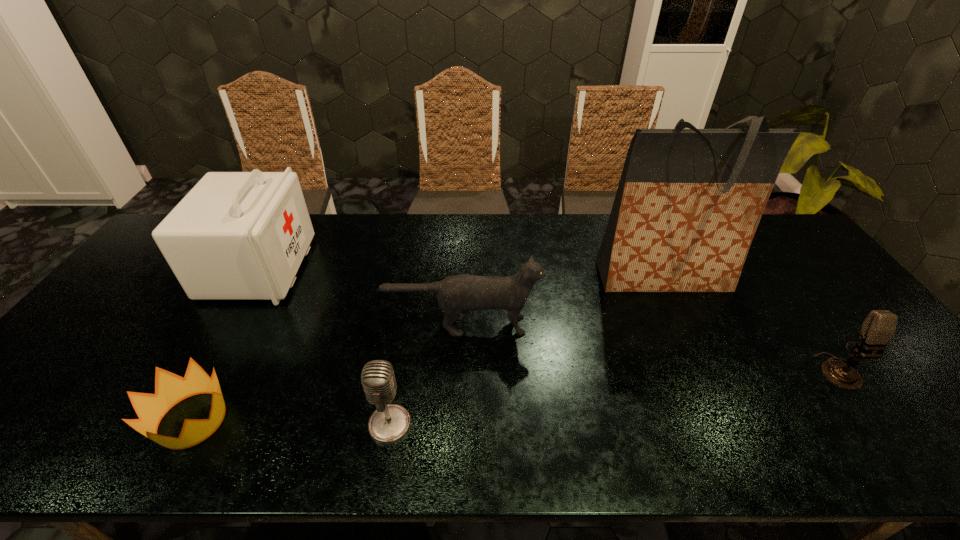
Identify the location of shopping bag. The height and width of the screenshot is (540, 960). tap(689, 201).

Locate an element on the screen. Image resolution: width=960 pixels, height=540 pixels. the second object from right to left is located at coordinates (689, 201).

Locate an element on the screen. The image size is (960, 540). the first-aid kit is located at coordinates (236, 235).

Identify the location of cat. pyautogui.click(x=459, y=292).

Find the location of a particular element. The height and width of the screenshot is (540, 960). the left microphone is located at coordinates (389, 423).

Identify the location of the farther microphone. The height and width of the screenshot is (540, 960). (879, 326).

Find the location of a particular element. The image size is (960, 540). the rightmost object is located at coordinates (879, 326).

At what (x,y) coordinates should I click in order to perform the action: click on crown. Please return your answer as a coordinate pair (x, y). Looking at the image, I should click on (170, 389).

The width and height of the screenshot is (960, 540). I want to click on free space located on the front-facing side of the shopping bag, so click(721, 404).

Find the location of a particular element. The width and height of the screenshot is (960, 540). vacant space located on the front-facing side of the first-aid kit is located at coordinates (428, 268).